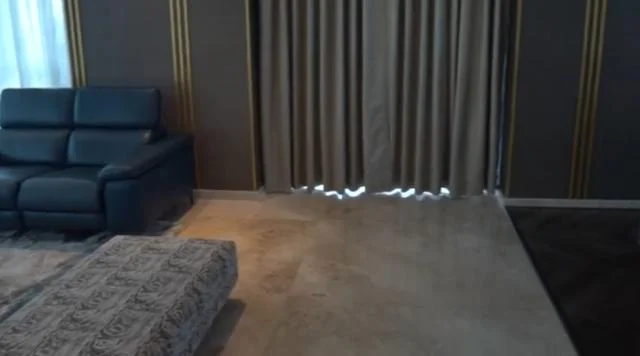
At what (x,y) coordinates should I click in order to perform the action: click on the left armrest. Please return your answer as a coordinate pair (x, y). The width and height of the screenshot is (640, 356). Looking at the image, I should click on (138, 161).